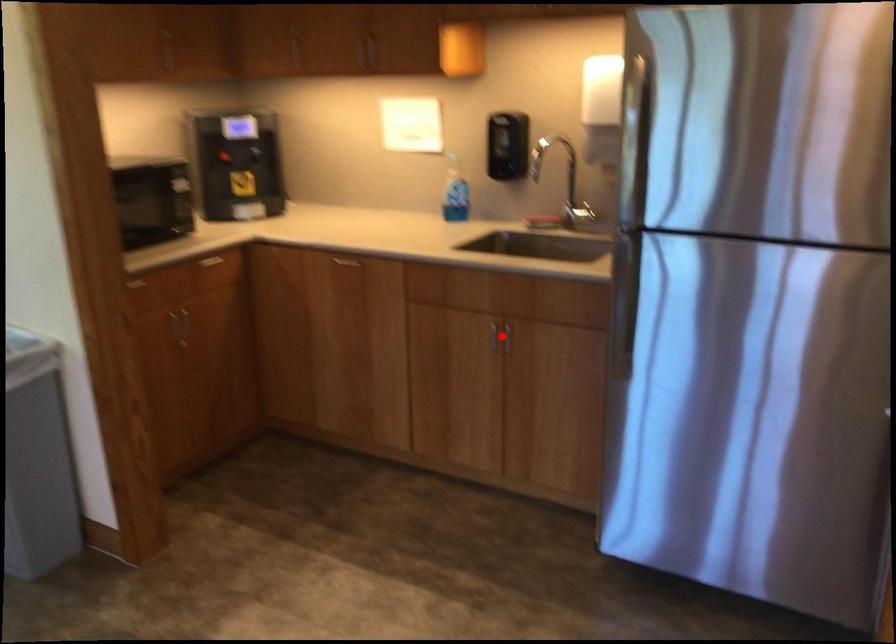
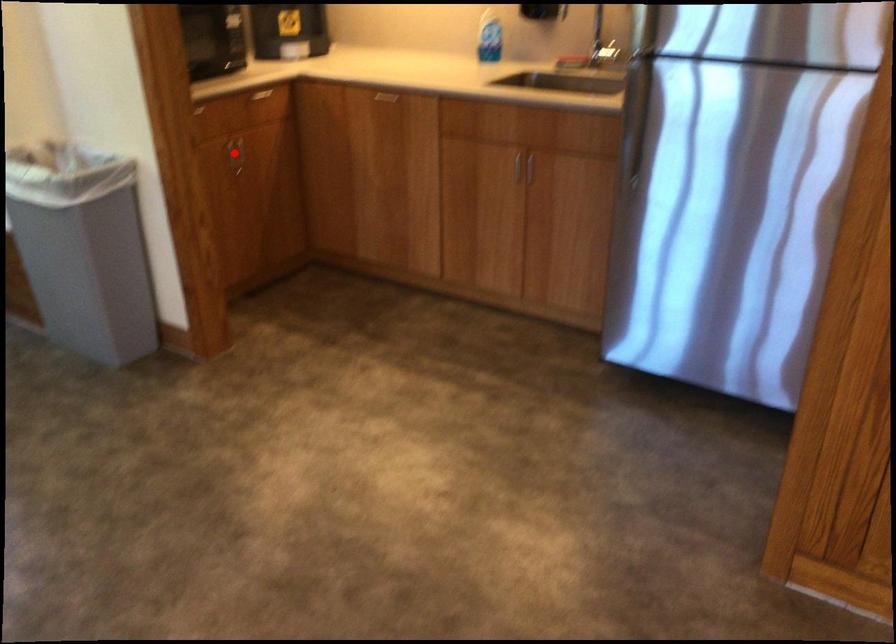
I am providing you with two images of the same scene from different viewpoints. A red point is marked on the first image and another point is marked on the second image. Is the marked point in image1 the same physical position as the marked point in image2?

No